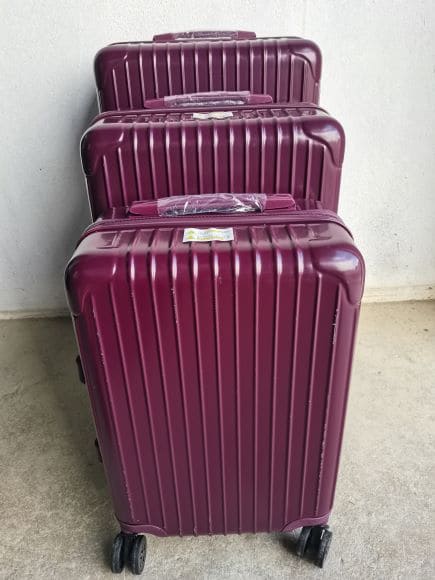
In order to click on black latches on left side of bottom suitcase in this screenshot , I will do `click(82, 372)`, `click(96, 465)`.